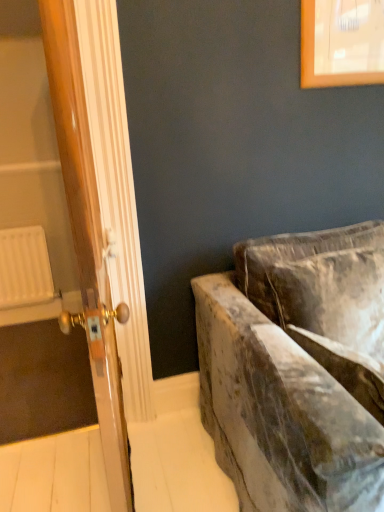
Question: From a real-world perspective, is velvet couch at right located beneath white plastic radiator at left?

Choices:
 (A) no
 (B) yes

Answer: (A)

Question: Would you say velvet couch at right contains white plastic radiator at left?

Choices:
 (A) yes
 (B) no

Answer: (B)

Question: Is velvet couch at right oriented towards white plastic radiator at left?

Choices:
 (A) no
 (B) yes

Answer: (A)

Question: From the image's perspective, is velvet couch at right located above white plastic radiator at left?

Choices:
 (A) yes
 (B) no

Answer: (B)

Question: Is velvet couch at right positioned in front of white plastic radiator at left?

Choices:
 (A) yes
 (B) no

Answer: (A)

Question: Is velvet couch at right far away from white plastic radiator at left?

Choices:
 (A) no
 (B) yes

Answer: (B)

Question: Is velvet couch at right at the left side of wooden door at left?

Choices:
 (A) yes
 (B) no

Answer: (B)

Question: Can you confirm if velvet couch at right is taller than wooden door at left?

Choices:
 (A) yes
 (B) no

Answer: (B)

Question: From a real-world perspective, does velvet couch at right sit lower than wooden door at left?

Choices:
 (A) yes
 (B) no

Answer: (A)

Question: From the image's perspective, is velvet couch at right located beneath wooden door at left?

Choices:
 (A) yes
 (B) no

Answer: (A)

Question: Does velvet couch at right come behind wooden door at left?

Choices:
 (A) no
 (B) yes

Answer: (A)

Question: Is velvet couch at right facing away from wooden door at left?

Choices:
 (A) no
 (B) yes

Answer: (A)

Question: From the image's perspective, does white plastic radiator at left appear higher than velvet couch at right?

Choices:
 (A) yes
 (B) no

Answer: (A)